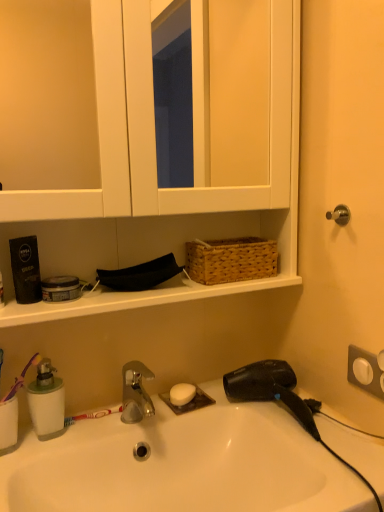
Locate an element on the screen. This screenshot has height=512, width=384. vacant region below black plastic hair dryer at lower right (from a real-world perspective) is located at coordinates (275, 413).